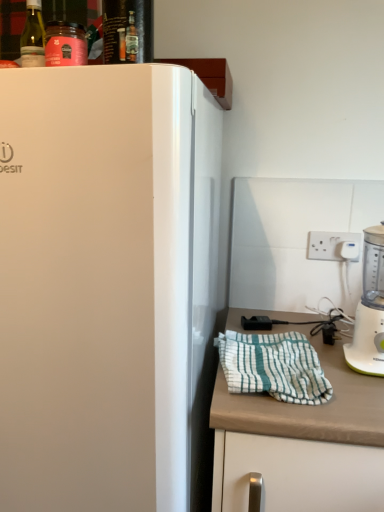
At what (x,y) coordinates should I click in order to perform the action: click on vacant area that is in front of white plastic blender at right. Please return your answer as a coordinate pair (x, y). The width and height of the screenshot is (384, 512). Looking at the image, I should click on (360, 397).